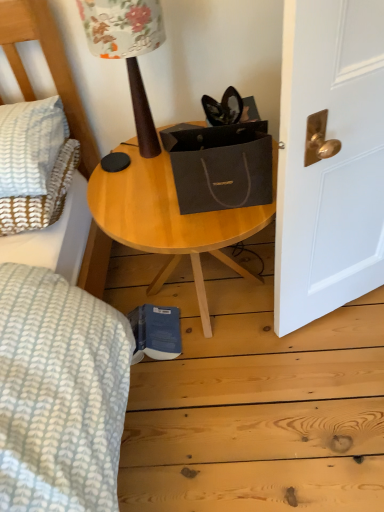
I want to click on free space on the front side of wooden table lamp at upper center, so [x=136, y=193].